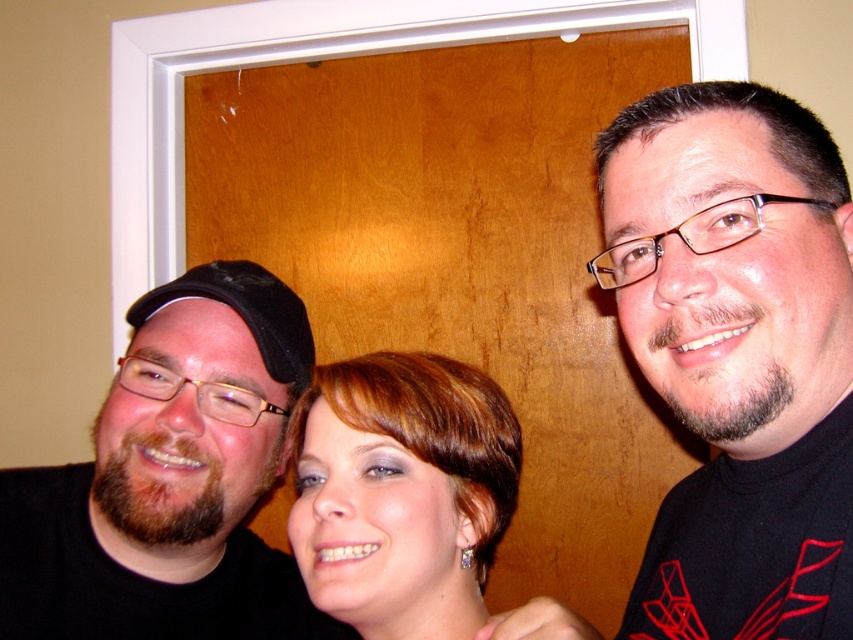
Does black matte t-shirt at right have a lesser height compared to black fabric baseball cap at left?

In fact, black matte t-shirt at right may be taller than black fabric baseball cap at left.

Image resolution: width=853 pixels, height=640 pixels. Describe the element at coordinates (738, 355) in the screenshot. I see `black matte t-shirt at right` at that location.

Locate an element on the screen. black matte t-shirt at right is located at coordinates (738, 355).

Which of these two, matte black cap at left or shiny brown hair at center, stands shorter?

shiny brown hair at center is shorter.

Who is positioned more to the right, matte black cap at left or shiny brown hair at center?

From the viewer's perspective, shiny brown hair at center appears more on the right side.

Locate an element on the screen. matte black cap at left is located at coordinates (171, 480).

Does shiny brown hair at center come in front of black fabric baseball cap at left?

Yes, it is.

Can you confirm if shiny brown hair at center is positioned above black fabric baseball cap at left?

Incorrect, shiny brown hair at center is not positioned above black fabric baseball cap at left.

Looking at this image, who is more distant from viewer, (358,544) or (276,317)?

Point (276,317)

The width and height of the screenshot is (853, 640). In order to click on shiny brown hair at center in this screenshot , I will do `click(401, 492)`.